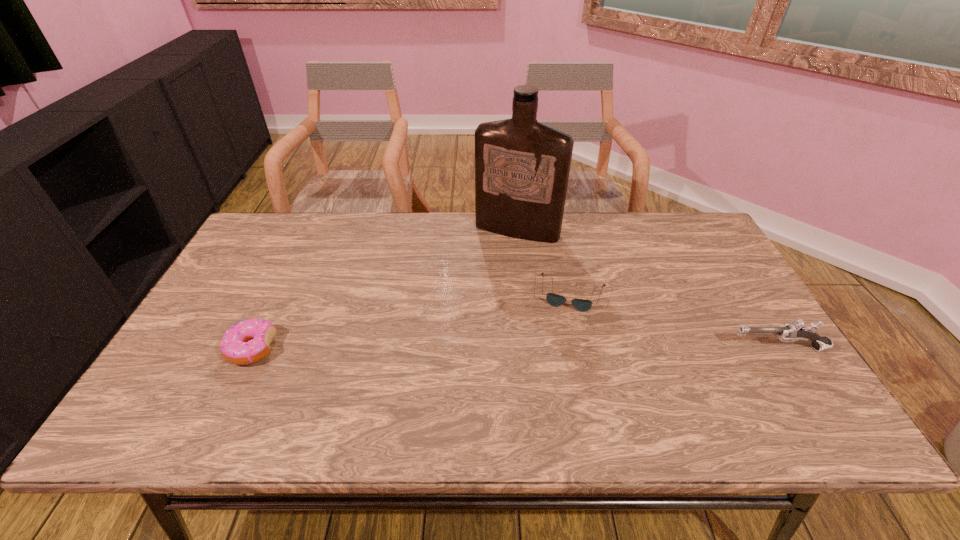
Where is `vacant space on the desktop that is between the third tallest object and the gun and is positioned on the label side of the tallest object`? The width and height of the screenshot is (960, 540). vacant space on the desktop that is between the third tallest object and the gun and is positioned on the label side of the tallest object is located at coordinates (463, 348).

This screenshot has width=960, height=540. I want to click on vacant space on the desktop that is between the leftmost object and the gun and is positioned on the lenses of the shortest object, so click(564, 348).